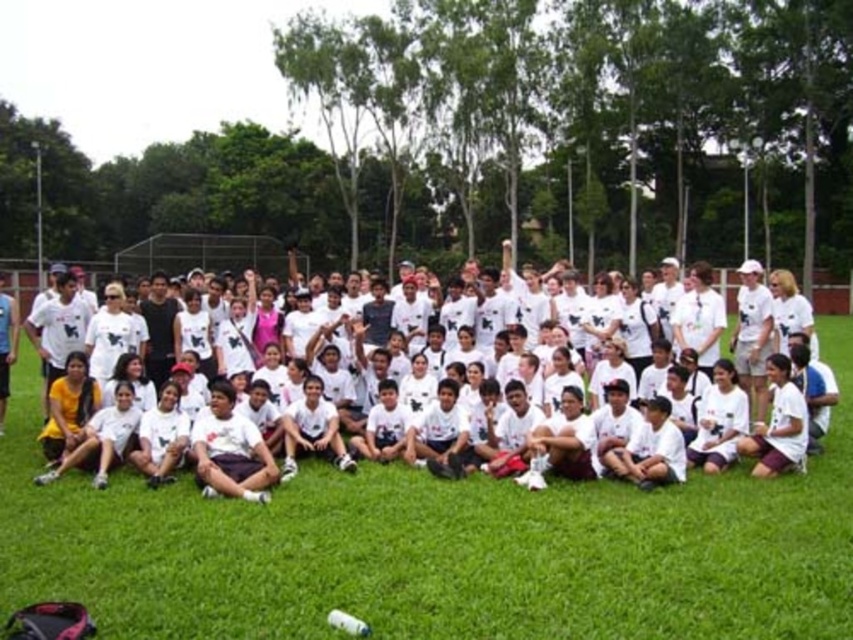
Question: Observing the image, what is the correct spatial positioning of green grass at center in reference to white cotton shirt at lower left?

Choices:
 (A) left
 (B) right

Answer: (B)

Question: Does green grass at center have a smaller size compared to white cotton shirt at lower left?

Choices:
 (A) no
 (B) yes

Answer: (B)

Question: Which object is the closest to the white cotton shirt at lower left?

Choices:
 (A) green grass at center
 (B) white cotton t-shirt at center

Answer: (B)

Question: Is green grass at center below white cotton shirt at lower left?

Choices:
 (A) no
 (B) yes

Answer: (B)

Question: Which object appears farthest from the camera in this image?

Choices:
 (A) green grass at center
 (B) white cotton t-shirt at center
 (C) white cotton shirt at lower left

Answer: (C)

Question: Which of the following is the closest to the observer?

Choices:
 (A) white cotton t-shirt at center
 (B) white cotton shirt at lower left
 (C) green grass at center

Answer: (C)